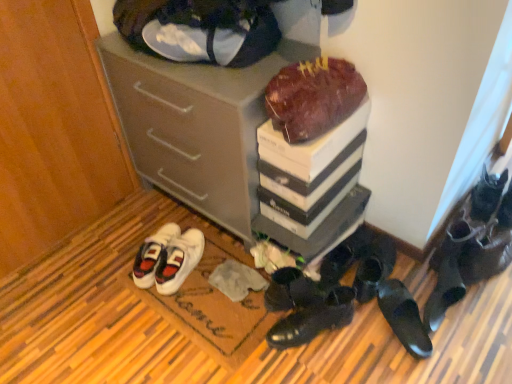
Image resolution: width=512 pixels, height=384 pixels. I want to click on empty space that is to the right of white suede sneakers at lower left, marked as the first footwear in a left-to-right arrangement, so click(214, 272).